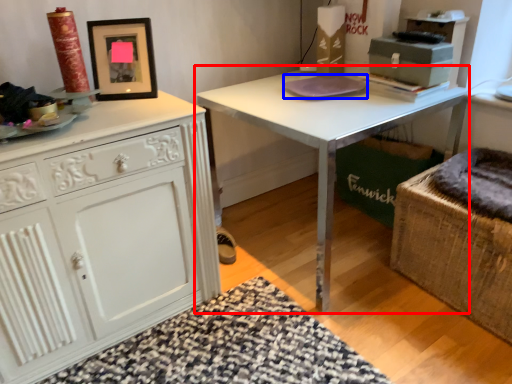
Question: Which object appears farthest to the camera in this image, table (highlighted by a red box) or pad (highlighted by a blue box)?

Choices:
 (A) table
 (B) pad

Answer: (B)